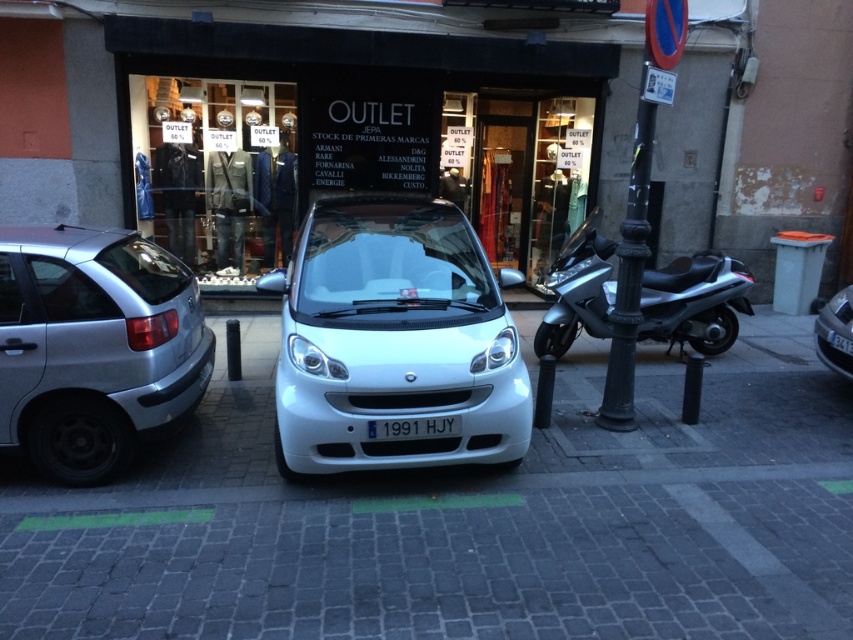
This screenshot has height=640, width=853. What do you see at coordinates (695, 301) in the screenshot?
I see `metallic silver scooter at right` at bounding box center [695, 301].

Identify the location of metallic silver scooter at right. (695, 301).

Does shiny black helmet at right have a smaller size compared to white plastic license plate at center?

No.

Consider the image. Is shiny black helmet at right positioned at the back of white plastic license plate at center?

Yes.

This screenshot has height=640, width=853. Identify the location of shiny black helmet at right. (834, 332).

You are a GUI agent. You are given a task and a screenshot of the screen. Output one action in this format:
    pyautogui.click(x=<x>, y=<y>)
    Task: Click on the shiny black helmet at right
    
    Given the screenshot: What is the action you would take?
    pyautogui.click(x=834, y=332)

Does metallic silver scooter at right have a greater height compared to dark gray metal pole at right?

In fact, metallic silver scooter at right may be shorter than dark gray metal pole at right.

In the scene shown: Is metallic silver scooter at right further to camera compared to dark gray metal pole at right?

Yes, metallic silver scooter at right is further from the viewer.

I want to click on metallic silver scooter at right, so click(x=695, y=301).